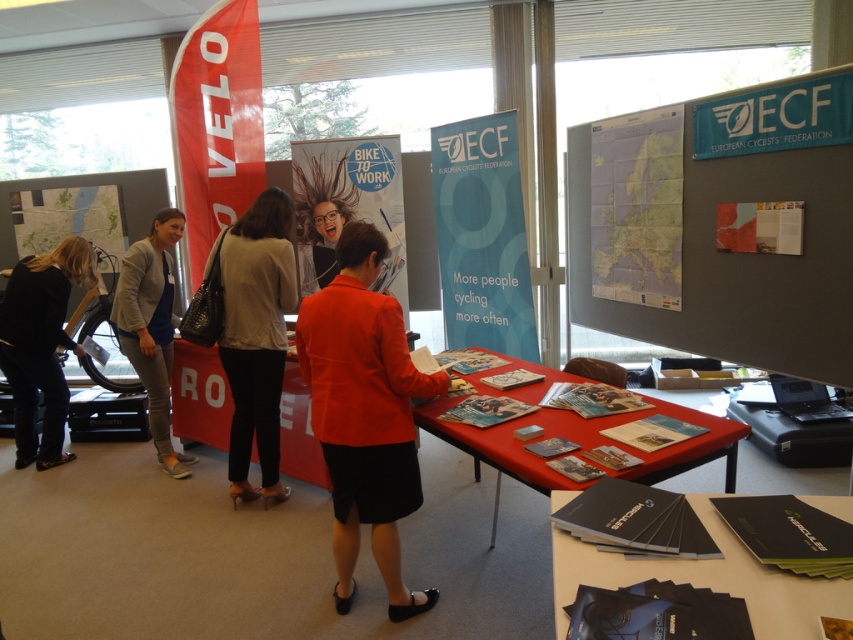
Based on the photo, how distant is blue paperboard at center from gray knit cardigan at left?

The distance of blue paperboard at center from gray knit cardigan at left is 5.96 feet.

Is point (495, 275) positioned in front of point (160, 340)?

That is False.

Between point (505, 134) and point (138, 369), which one is positioned in front?

Point (138, 369) is more forward.

I want to click on blue paperboard at center, so click(482, 236).

Can you confirm if shiny metallic poster at center is positioned to the right of matte paper map at center?

No, shiny metallic poster at center is not to the right of matte paper map at center.

Can you confirm if shiny metallic poster at center is positioned above matte paper map at center?

Correct, shiny metallic poster at center is located above matte paper map at center.

The image size is (853, 640). Identify the location of shiny metallic poster at center. (347, 205).

Does red fabric table at center have a lesser width compared to black fabric at left?

Incorrect, red fabric table at center's width is not less than black fabric at left's.

Image resolution: width=853 pixels, height=640 pixels. Find the location of `red fabric table at center`. red fabric table at center is located at coordinates [x=656, y=451].